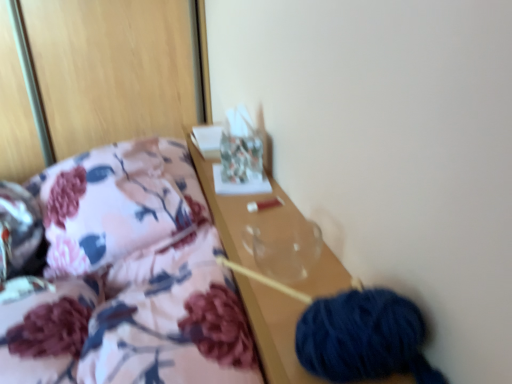
Question: Is transparent glass vase at center positioned in front of dark blue yarn at lower right?

Choices:
 (A) no
 (B) yes

Answer: (A)

Question: Does transparent glass vase at center have a larger size compared to dark blue yarn at lower right?

Choices:
 (A) yes
 (B) no

Answer: (B)

Question: Is transparent glass vase at center next to dark blue yarn at lower right?

Choices:
 (A) yes
 (B) no

Answer: (B)

Question: From the image's perspective, is transparent glass vase at center under dark blue yarn at lower right?

Choices:
 (A) yes
 (B) no

Answer: (B)

Question: Is transparent glass vase at center to the right of dark blue yarn at lower right from the viewer's perspective?

Choices:
 (A) no
 (B) yes

Answer: (A)

Question: Is dark blue yarn at lower right situated inside floral fabric pillow at left or outside?

Choices:
 (A) outside
 (B) inside

Answer: (A)

Question: Is dark blue yarn at lower right bigger or smaller than floral fabric pillow at left?

Choices:
 (A) big
 (B) small

Answer: (B)

Question: From a real-world perspective, is dark blue yarn at lower right positioned above or below floral fabric pillow at left?

Choices:
 (A) above
 (B) below

Answer: (A)

Question: Visually, is dark blue yarn at lower right positioned to the left or to the right of floral fabric pillow at left?

Choices:
 (A) left
 (B) right

Answer: (B)

Question: Is point pos(77,175) closer or farther from the camera than point pos(257,226)?

Choices:
 (A) closer
 (B) farther

Answer: (B)

Question: In terms of size, does floral fabric pillow at left appear bigger or smaller than transparent glass vase at center?

Choices:
 (A) small
 (B) big

Answer: (B)

Question: From a real-world perspective, is floral fabric pillow at left physically located above or below transparent glass vase at center?

Choices:
 (A) below
 (B) above

Answer: (A)

Question: Considering the positions of floral fabric pillow at left and transparent glass vase at center in the image, is floral fabric pillow at left wider or thinner than transparent glass vase at center?

Choices:
 (A) wide
 (B) thin

Answer: (A)

Question: Is transparent glass vase at center to the left or to the right of floral fabric pillow at left in the image?

Choices:
 (A) right
 (B) left

Answer: (A)

Question: Is point pos(284,251) closer or farther from the camera than point pos(135,183)?

Choices:
 (A) farther
 (B) closer

Answer: (B)